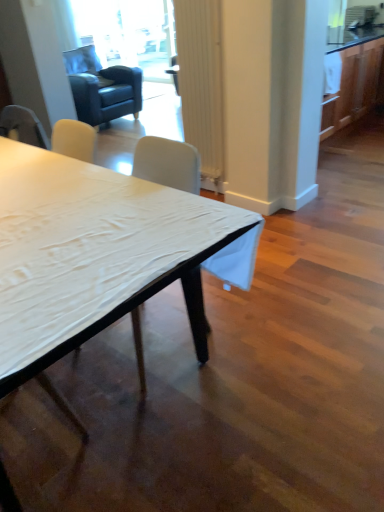
Question: Is white ribbed curtain at center far from white fabric chair at center?

Choices:
 (A) no
 (B) yes

Answer: (B)

Question: Is white ribbed curtain at center to the left of white fabric chair at center from the viewer's perspective?

Choices:
 (A) no
 (B) yes

Answer: (A)

Question: Is white ribbed curtain at center at the right side of white fabric chair at center?

Choices:
 (A) yes
 (B) no

Answer: (A)

Question: Is white ribbed curtain at center facing away from white fabric chair at center?

Choices:
 (A) yes
 (B) no

Answer: (B)

Question: Is white ribbed curtain at center positioned behind white fabric chair at center?

Choices:
 (A) yes
 (B) no

Answer: (A)

Question: Considering the relative sizes of white ribbed curtain at center and white fabric chair at center in the image provided, is white ribbed curtain at center taller than white fabric chair at center?

Choices:
 (A) yes
 (B) no

Answer: (B)

Question: Is dark blue leather swivel chair at upper left not inside transparent glass door at upper center?

Choices:
 (A) no
 (B) yes

Answer: (B)

Question: Is dark blue leather swivel chair at upper left facing towards transparent glass door at upper center?

Choices:
 (A) no
 (B) yes

Answer: (A)

Question: Is the surface of dark blue leather swivel chair at upper left in direct contact with transparent glass door at upper center?

Choices:
 (A) no
 (B) yes

Answer: (A)

Question: Is the depth of dark blue leather swivel chair at upper left less than that of transparent glass door at upper center?

Choices:
 (A) yes
 (B) no

Answer: (A)

Question: From a real-world perspective, is dark blue leather swivel chair at upper left positioned over transparent glass door at upper center based on gravity?

Choices:
 (A) no
 (B) yes

Answer: (A)

Question: Would you say dark blue leather swivel chair at upper left contains transparent glass door at upper center?

Choices:
 (A) no
 (B) yes

Answer: (A)

Question: Are white fabric chair at center and white matte table at center far apart?

Choices:
 (A) yes
 (B) no

Answer: (B)